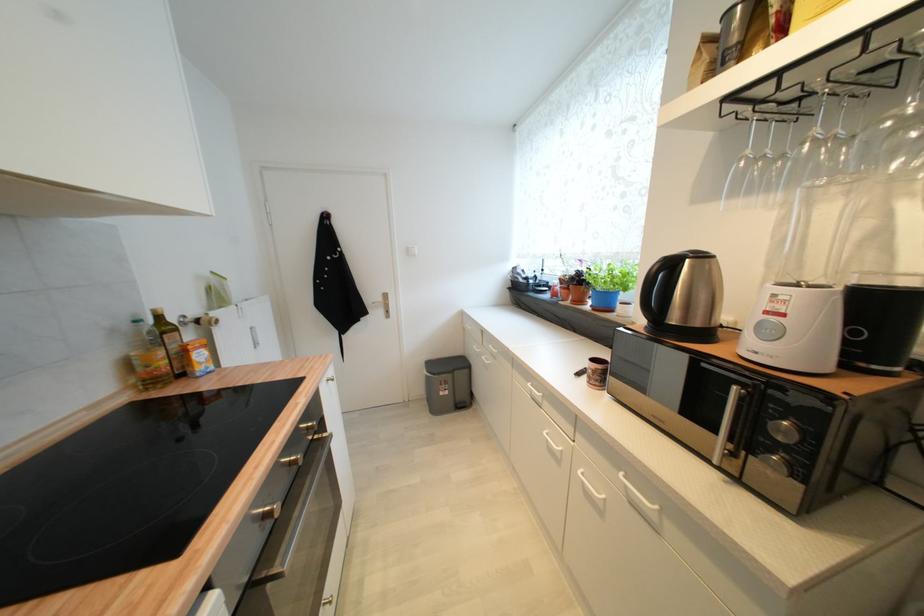
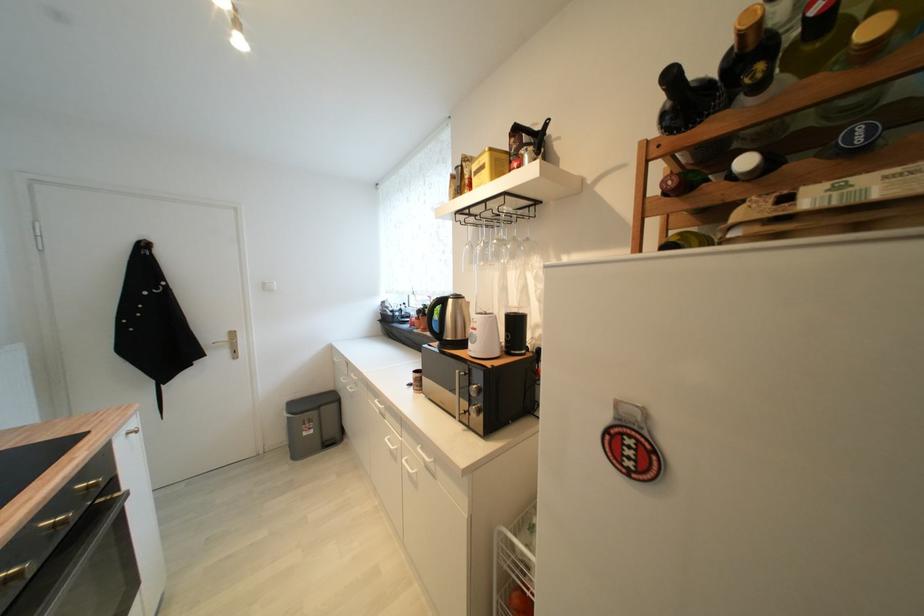
Where in the second image is the point corresponding to [787,317] from the first image?

(480, 331)